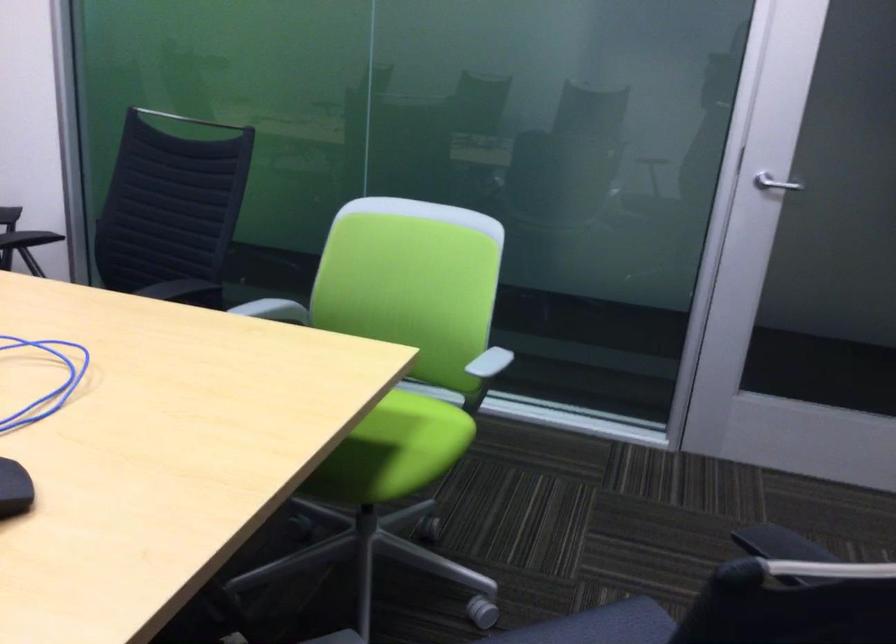
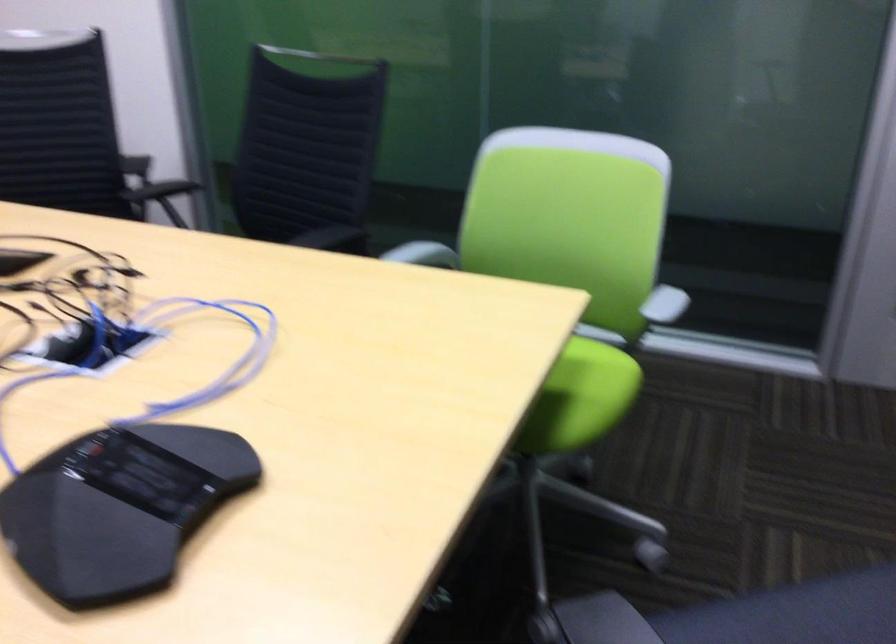
Locate, in the second image, the point that corresponds to (x=490, y=370) in the first image.

(659, 310)